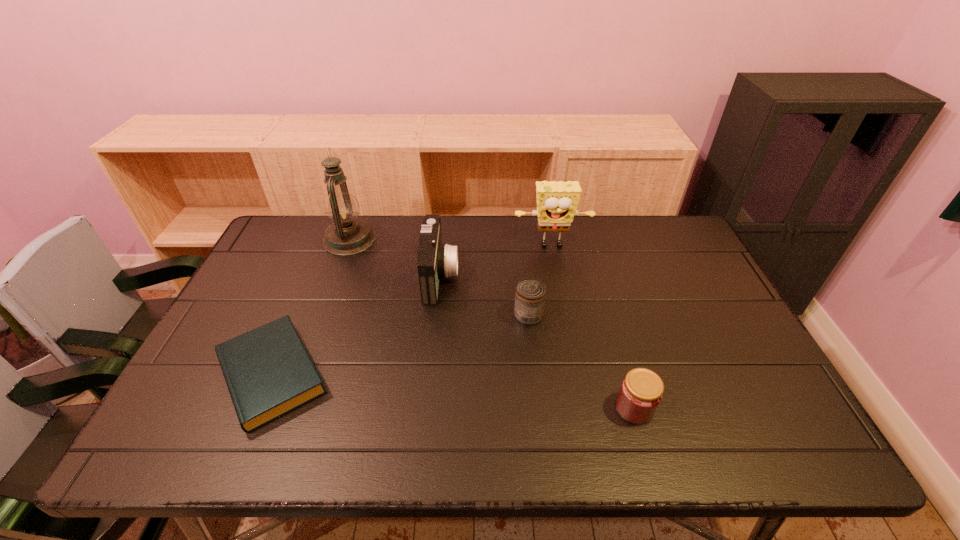
Where is `oil lamp`? Image resolution: width=960 pixels, height=540 pixels. oil lamp is located at coordinates (347, 235).

Where is `sponge`? The height and width of the screenshot is (540, 960). sponge is located at coordinates (557, 202).

At what (x,y) coordinates should I click in order to perform the action: click on the fourth object from right to left. Please return your answer as a coordinate pair (x, y). The width and height of the screenshot is (960, 540). Looking at the image, I should click on (435, 260).

Image resolution: width=960 pixels, height=540 pixels. In order to click on the fourth shortest object in this screenshot , I will do `click(435, 260)`.

Find the location of a particular element. This screenshot has height=540, width=960. can is located at coordinates (530, 295).

Locate an element on the screen. The width and height of the screenshot is (960, 540). jam is located at coordinates (640, 394).

In order to click on book in this screenshot , I will do `click(268, 371)`.

This screenshot has width=960, height=540. What are the coordinates of `free space located 0.250m on the front of the tallest object` in the screenshot? It's located at (324, 312).

Identify the location of vacant space situated on the front-facing side of the fifth shortest object. (556, 265).

Image resolution: width=960 pixels, height=540 pixels. What are the coordinates of `free region located 0.160m on the lens of the camcorder` in the screenshot? It's located at (510, 276).